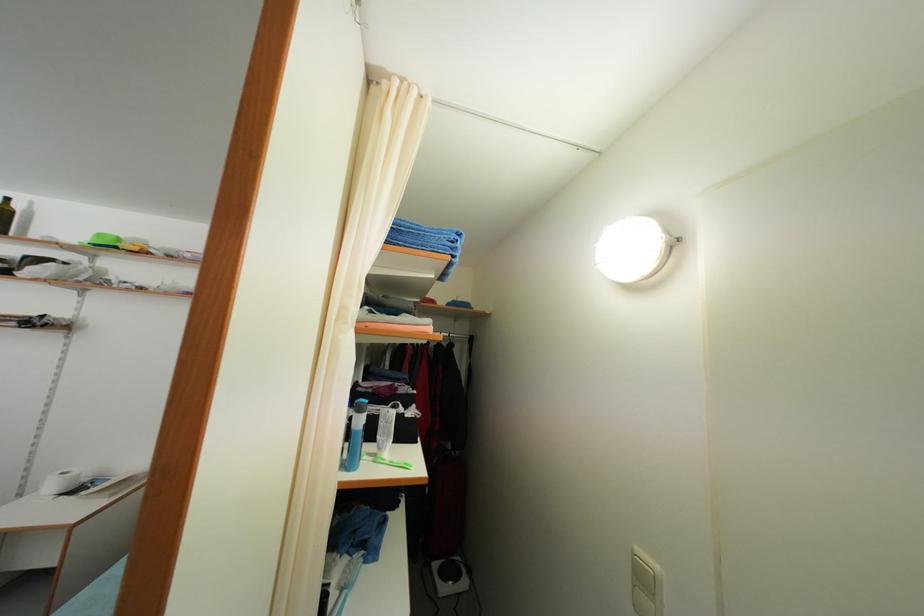
Which object does [356,435] point to?

This point indicates the white bottle.